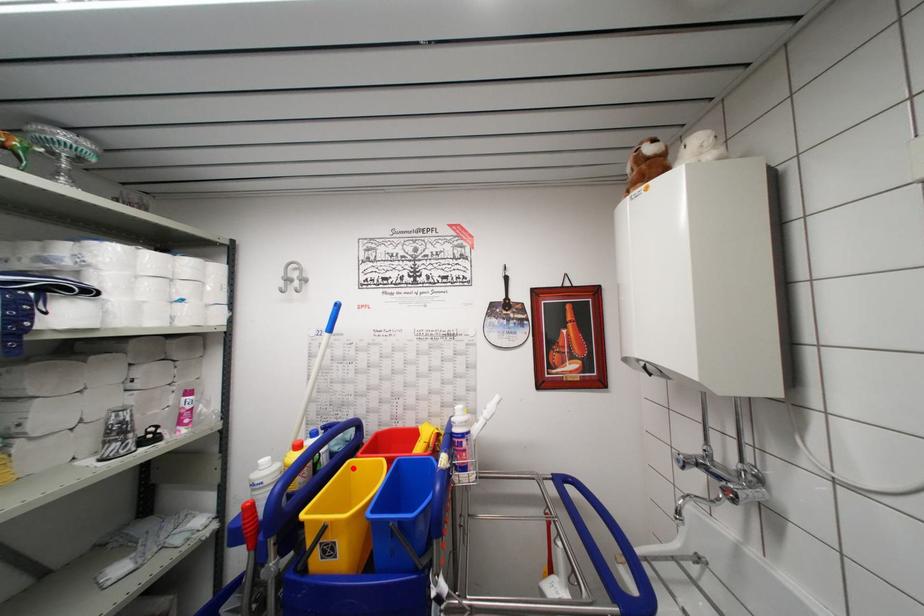
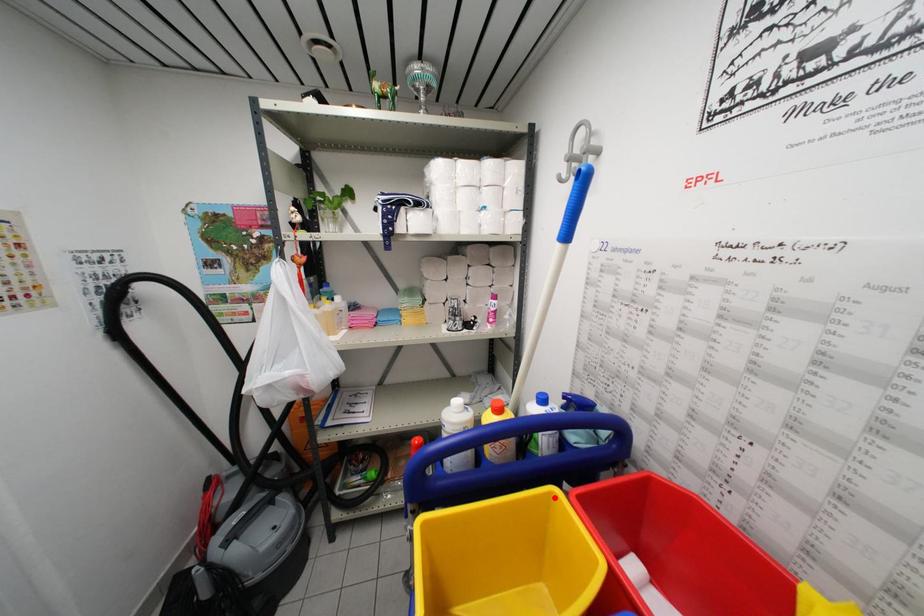
I am providing you with two images of the same scene from different viewpoints. A red point is marked on the first image and another point is marked on the second image. Is the red point in image1 aligned with the point shown in image2?

Yes